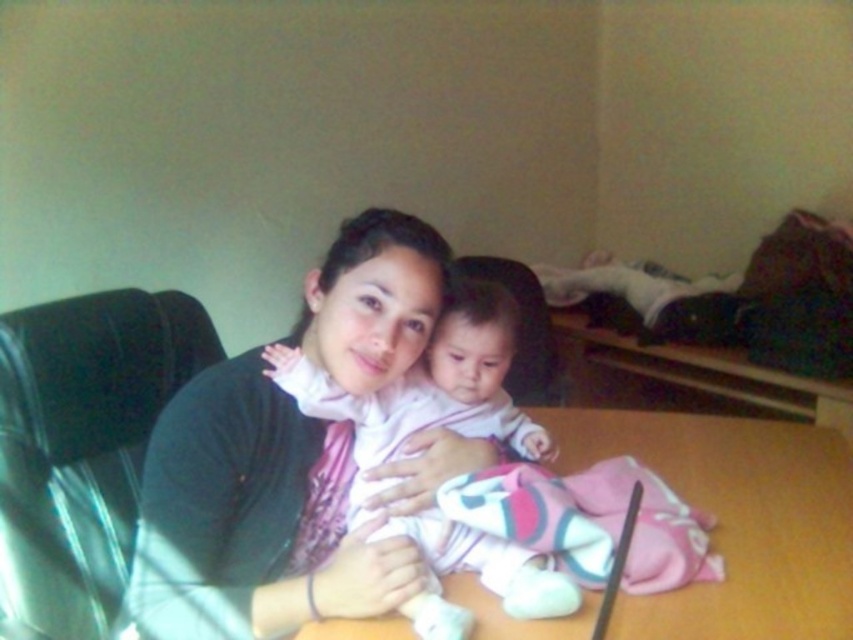
Question: Is the position of wooden table at center less distant than that of pink soft fabric baby at center?

Choices:
 (A) yes
 (B) no

Answer: (B)

Question: Observing the image, what is the correct spatial positioning of wooden table at center in reference to pink soft fabric baby at center?

Choices:
 (A) left
 (B) right

Answer: (B)

Question: Does wooden table at center have a greater width compared to pink soft fabric baby at center?

Choices:
 (A) yes
 (B) no

Answer: (A)

Question: Which point is closer to the camera?

Choices:
 (A) wooden table at center
 (B) pink soft fabric baby at center

Answer: (B)

Question: Which of the following is the closest to the observer?

Choices:
 (A) (648, 464)
 (B) (433, 522)

Answer: (B)